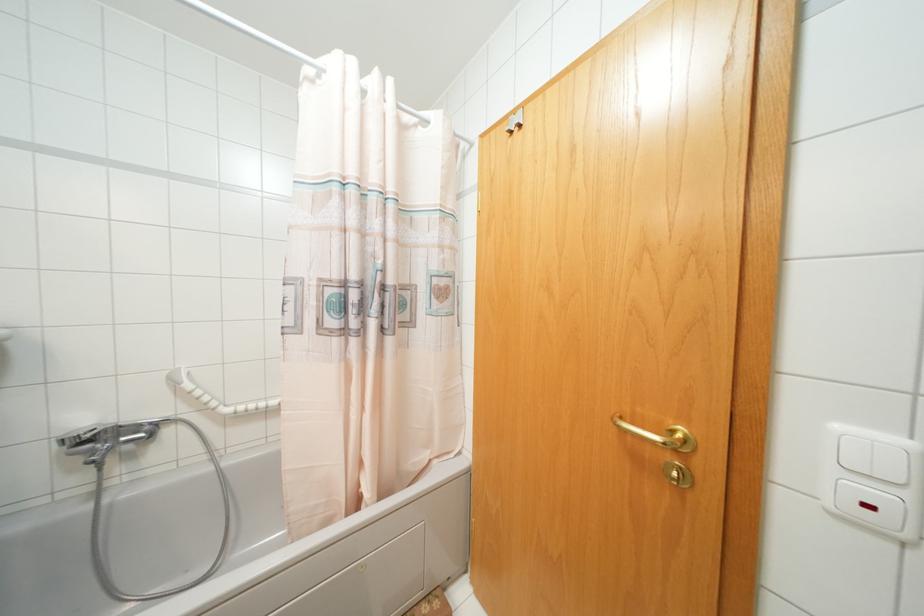
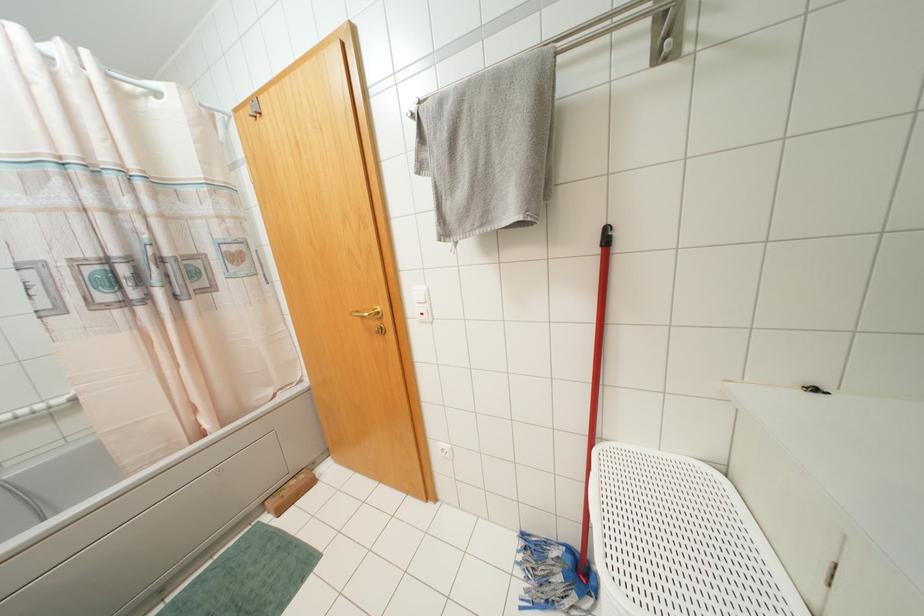
Where in the second image is the point corresponding to point (686, 440) from the first image?

(378, 312)